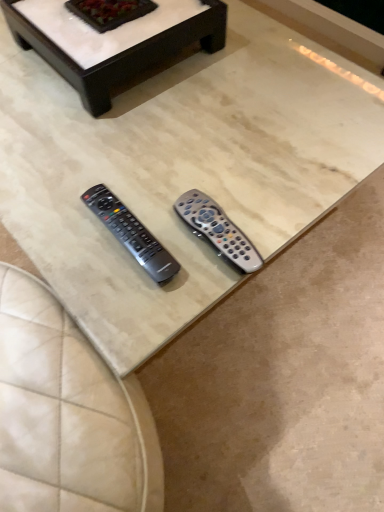
Identify the location of vacant area that lies to the right of translucent gray remote at center, arranged as the 1th remote control when viewed from the right. (288, 204).